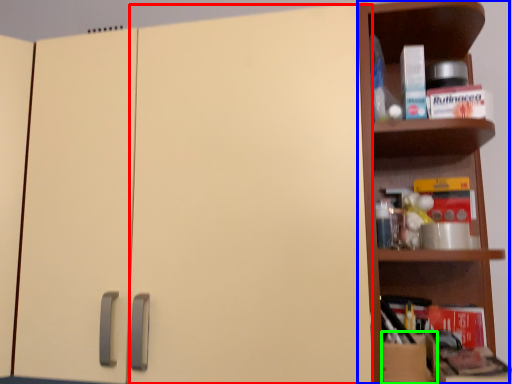
Question: Based on their relative distances, which object is nearer to door (highlighted by a red box)? Choose from shelf (highlighted by a blue box) and cardboard box (highlighted by a green box).

Choices:
 (A) shelf
 (B) cardboard box

Answer: (A)